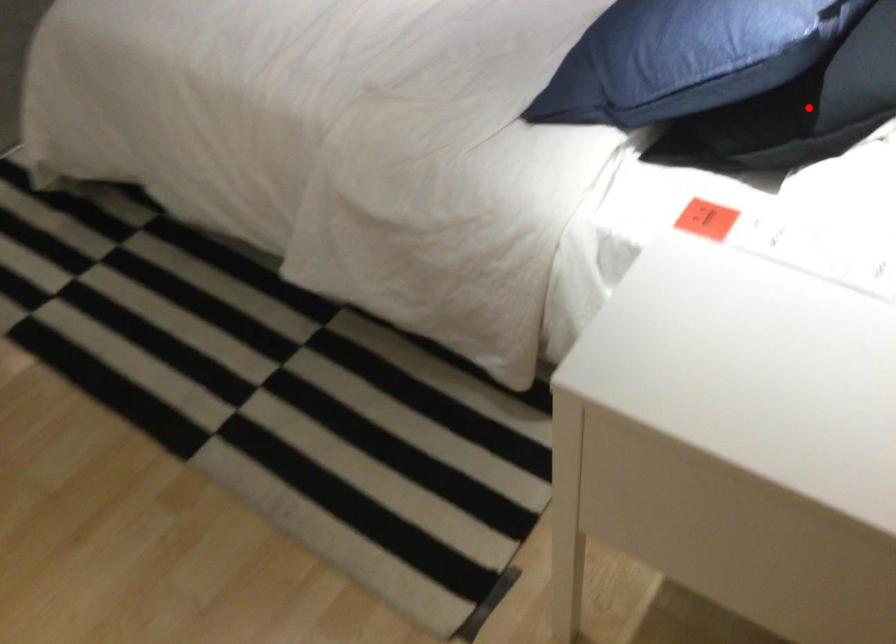
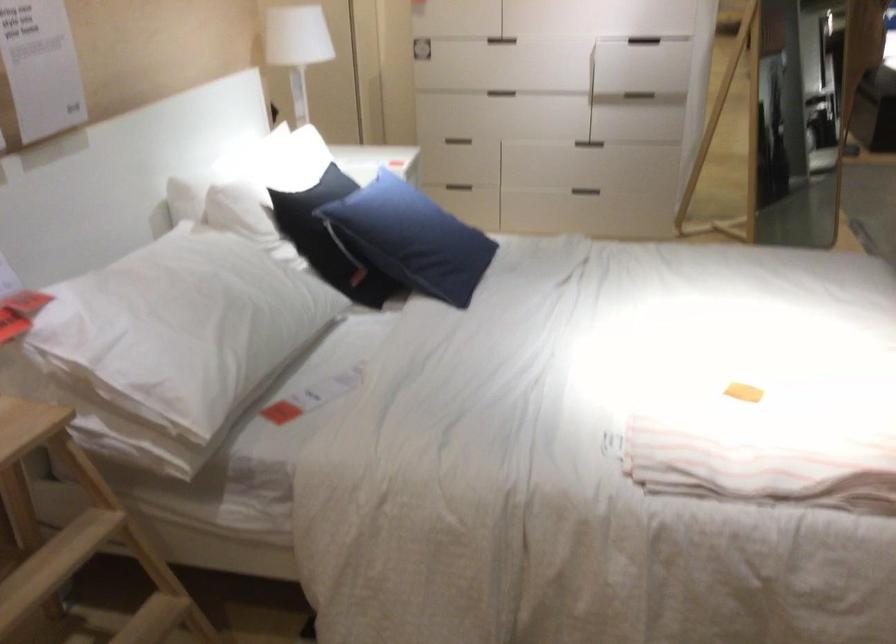
Question: I am providing you with two images of the same scene from different viewpoints. A red point is marked on the first image. At the location where the point appears in image 1, is it still visible in image 2?

Choices:
 (A) Yes
 (B) No

Answer: (B)